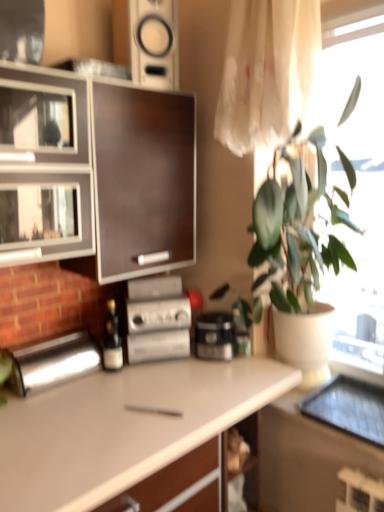
Identify the location of free spot to the left of black plastic coffee maker at center. (177, 365).